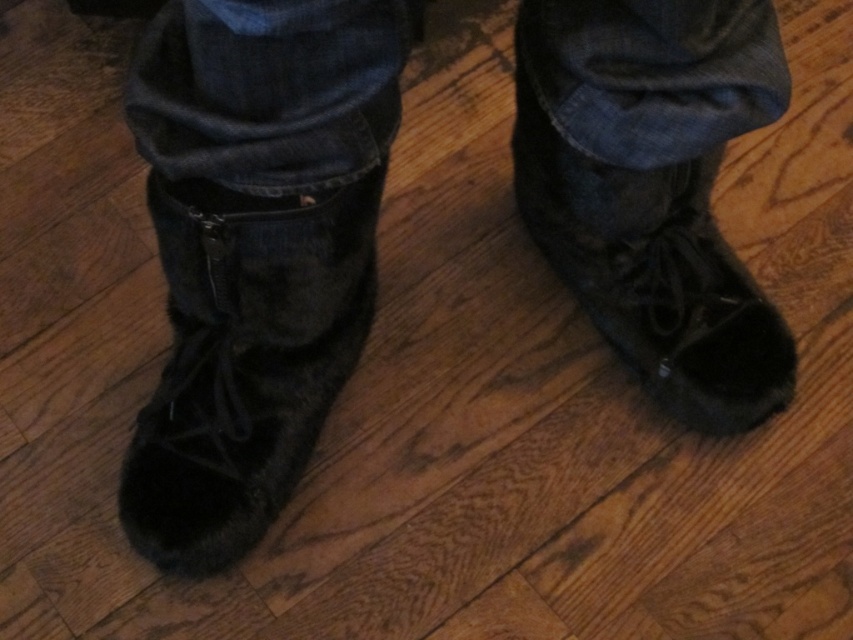
Can you confirm if denim at center is thinner than black suede boot at center?

No.

Measure the distance between point (639, 150) and camera.

A distance of 34.64 inches exists between point (639, 150) and camera.

Where is `denim at center`? The height and width of the screenshot is (640, 853). denim at center is located at coordinates (268, 90).

Find the location of a particular element. This screenshot has height=640, width=853. denim at center is located at coordinates (268, 90).

Does denim at center have a lesser width compared to fuzzy black boot at left?

No, denim at center is not thinner than fuzzy black boot at left.

This screenshot has height=640, width=853. What do you see at coordinates (268, 90) in the screenshot?
I see `denim at center` at bounding box center [268, 90].

The width and height of the screenshot is (853, 640). I want to click on denim at center, so click(x=268, y=90).

Is fuzzy black boot at left smaller than black suede boot at center?

Yes, fuzzy black boot at left is smaller than black suede boot at center.

Which is behind, point (225, 449) or point (683, 240)?

The point (683, 240) is behind.

Based on the photo, measure the distance between fuzzy black boot at left and camera.

32.92 inches

You are a GUI agent. You are given a task and a screenshot of the screen. Output one action in this format:
    pyautogui.click(x=<x>, y=<y>)
    Task: Click on the fuzzy black boot at left
    The width and height of the screenshot is (853, 640).
    Given the screenshot: What is the action you would take?
    pyautogui.click(x=244, y=360)